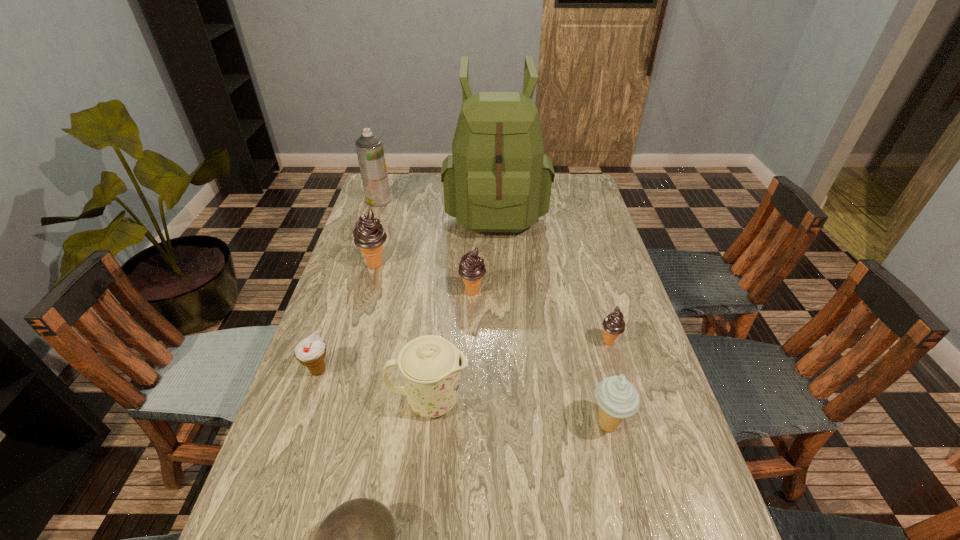
Where is `vacant area that satisfies the following two spatial constraints: 1. on the front pocket of the beige icecream; 2. on the right side of the tallest object`? The width and height of the screenshot is (960, 540). vacant area that satisfies the following two spatial constraints: 1. on the front pocket of the beige icecream; 2. on the right side of the tallest object is located at coordinates (506, 424).